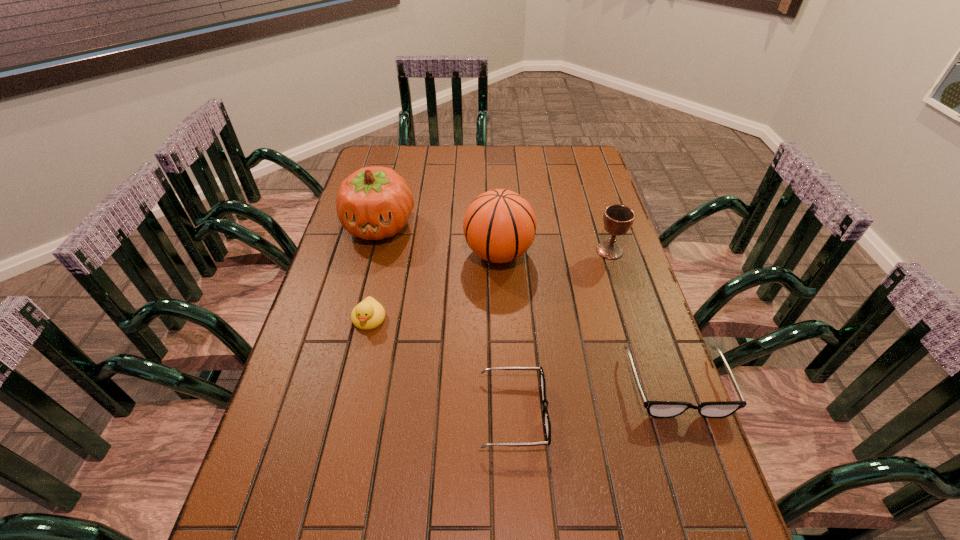
Where is `free space at the right edge of the desktop`? free space at the right edge of the desktop is located at coordinates (579, 208).

Find the location of `free space at the far left corner of the desktop`. free space at the far left corner of the desktop is located at coordinates coord(392,154).

The height and width of the screenshot is (540, 960). I want to click on vacant space that is in between the fourth shortest object and the fourth farthest object, so click(x=490, y=285).

The image size is (960, 540). What are the coordinates of `unoccupied position between the fourth farthest object and the shorter spectacles` in the screenshot? It's located at (441, 366).

Identify the location of unoccupied position between the fourth farthest object and the right spectacles. The image size is (960, 540). (523, 352).

The height and width of the screenshot is (540, 960). Identify the location of free spot between the third tallest object and the second shortest object. (643, 318).

Where is `unoccupied area between the duckling and the right spectacles`? The width and height of the screenshot is (960, 540). unoccupied area between the duckling and the right spectacles is located at coordinates (523, 352).

At what (x,y) coordinates should I click in order to perform the action: click on empty space that is in between the chalice and the fourth farthest object. Please return your answer as a coordinate pair (x, y). Looking at the image, I should click on (490, 285).

Locate an element on the screen. This screenshot has height=540, width=960. free space between the fourth farthest object and the chalice is located at coordinates (490, 285).

You are a GUI agent. You are given a task and a screenshot of the screen. Output one action in this format:
    pyautogui.click(x=<x>, y=<y>)
    Task: Click on the unoccupied area between the duckling and the shortest object
    
    Given the screenshot: What is the action you would take?
    pos(441,366)